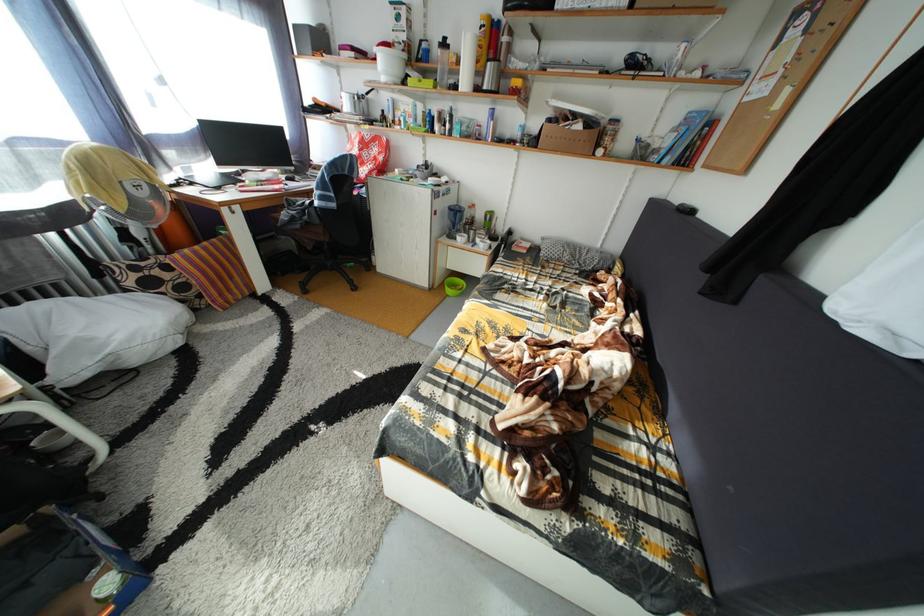
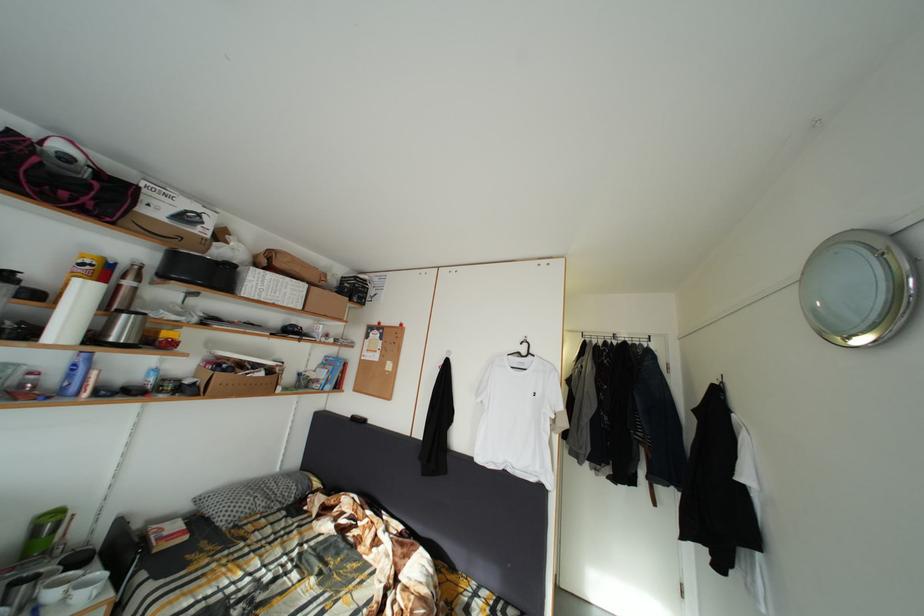
In the second image, find the point that corresponds to (x=493, y=95) in the first image.

(120, 345)